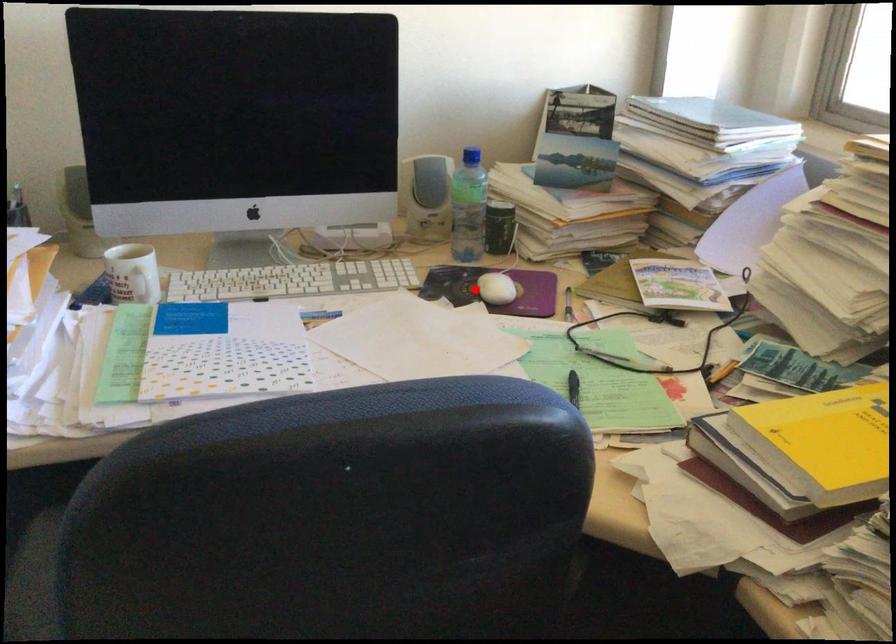
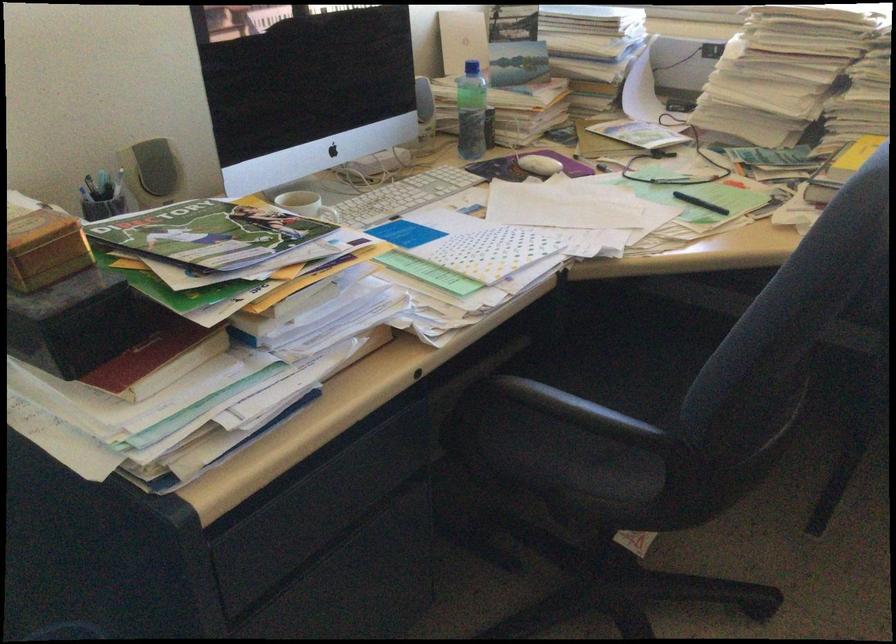
Question: I am providing you with two images of the same scene from different viewpoints. Given a red point in image1, look at the same physical point in image2. Is it:

Choices:
 (A) Closer to the viewpoint
 (B) Farther from the viewpoint

Answer: (B)